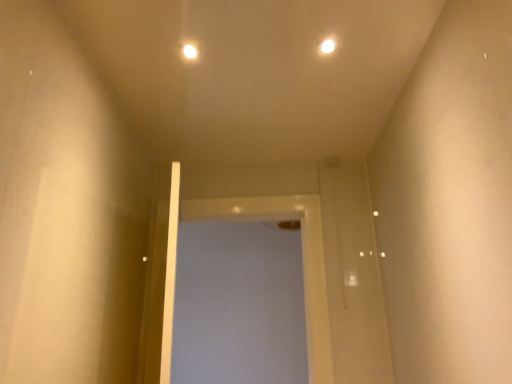
Question: Is white glossy screen door at center completely or partially outside of white glossy light at upper center, the first light when ordered from left to right?

Choices:
 (A) no
 (B) yes

Answer: (B)

Question: From a real-world perspective, is white glossy screen door at center positioned over white glossy light at upper center, the second light positioned from the right, based on gravity?

Choices:
 (A) yes
 (B) no

Answer: (B)

Question: Would you say white glossy screen door at center contains white glossy light at upper center, the second light positioned from the right?

Choices:
 (A) no
 (B) yes

Answer: (A)

Question: Can you confirm if white glossy screen door at center is positioned to the left of white glossy light at upper center, the first light when ordered from left to right?

Choices:
 (A) no
 (B) yes

Answer: (A)

Question: From the image's perspective, would you say white glossy screen door at center is shown under white glossy light at upper center, the first light when ordered from left to right?

Choices:
 (A) yes
 (B) no

Answer: (A)

Question: Do you think white glossy screen door at center is within white glossy light at upper center, the 2th light in the left-to-right sequence, or outside of it?

Choices:
 (A) inside
 (B) outside

Answer: (B)

Question: From a real-world perspective, is white glossy screen door at center above or below white glossy light at upper center, the 2th light in the left-to-right sequence?

Choices:
 (A) above
 (B) below

Answer: (B)

Question: In terms of height, does white glossy screen door at center look taller or shorter compared to white glossy light at upper center, the 2th light in the left-to-right sequence?

Choices:
 (A) short
 (B) tall

Answer: (B)

Question: Is white glossy screen door at center wider or thinner than white glossy light at upper center, the 2th light in the left-to-right sequence?

Choices:
 (A) wide
 (B) thin

Answer: (A)

Question: Is white glossy screen door at center situated inside white glossy light at upper center, the second light positioned from the right, or outside?

Choices:
 (A) outside
 (B) inside

Answer: (A)

Question: In the image, is white glossy screen door at center on the left side or the right side of white glossy light at upper center, the first light when ordered from left to right?

Choices:
 (A) left
 (B) right

Answer: (B)

Question: Is white glossy screen door at center wider or thinner than white glossy light at upper center, the second light positioned from the right?

Choices:
 (A) wide
 (B) thin

Answer: (A)

Question: Is point (324, 327) closer or farther from the camera than point (182, 49)?

Choices:
 (A) closer
 (B) farther

Answer: (B)

Question: Considering the positions of point (187, 43) and point (320, 276), is point (187, 43) closer or farther from the camera than point (320, 276)?

Choices:
 (A) farther
 (B) closer

Answer: (B)

Question: From the image's perspective, is white glossy light at upper center, the first light when ordered from left to right, located above or below white glossy screen door at center?

Choices:
 (A) below
 (B) above

Answer: (B)